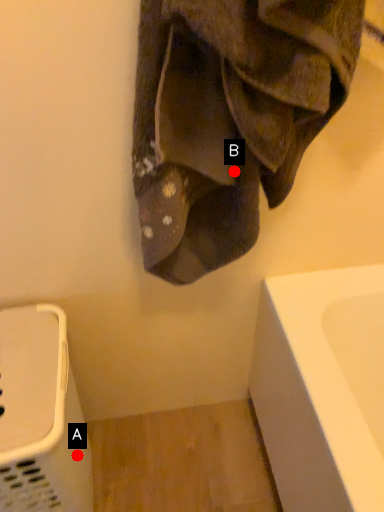
Question: Two points are circled on the image, labeled by A and B beside each circle. Which point is further to the camera?

Choices:
 (A) A is further
 (B) B is further

Answer: (A)